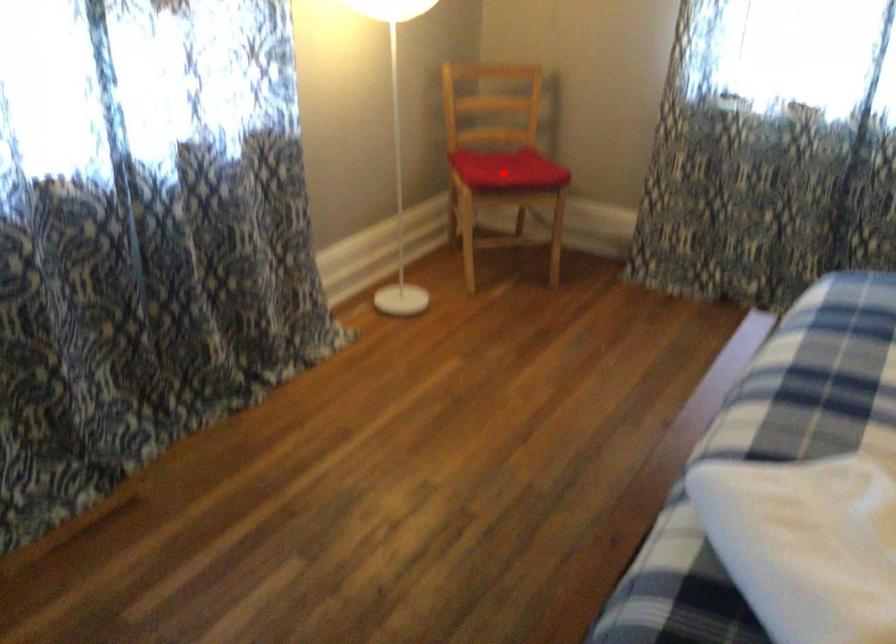
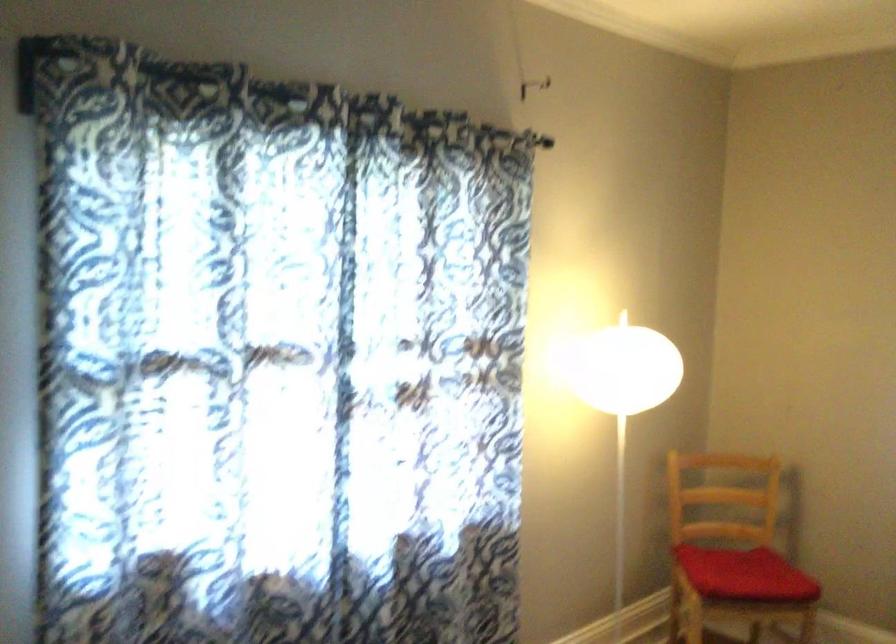
Question: I am providing you with two images of the same scene from different viewpoints. In image1, a red point is highlighted. Considering the same 3D point in image2, which of the following is correct?

Choices:
 (A) It is closer
 (B) It is farther

Answer: (A)